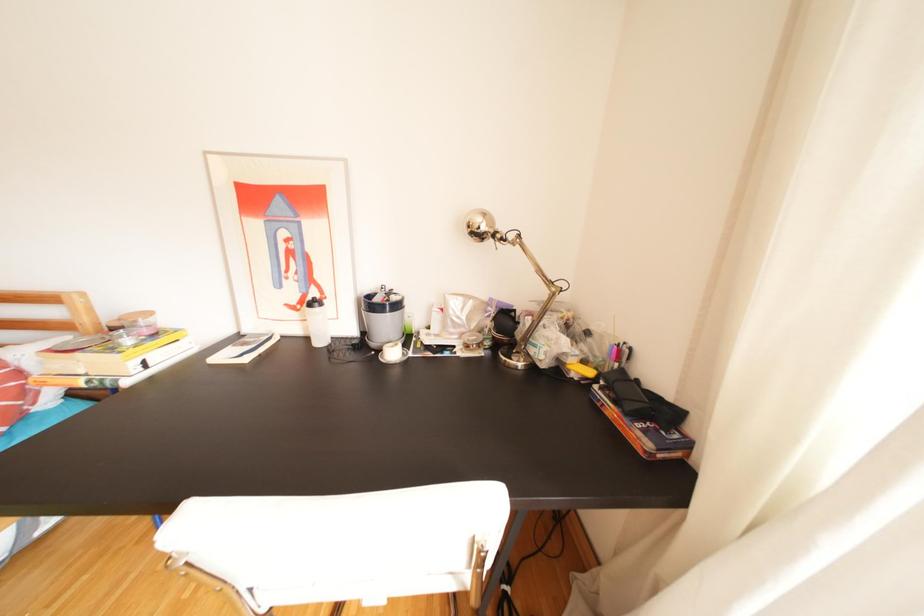
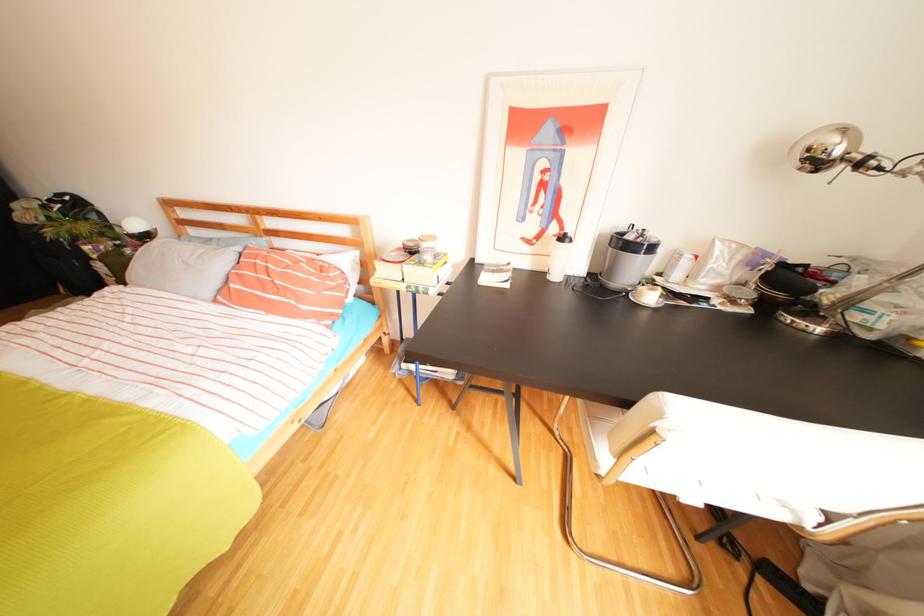
Question: What movement of the cameraman would produce the second image?

Choices:
 (A) Left
 (B) Right
 (C) Forward
 (D) Backward

Answer: (A)